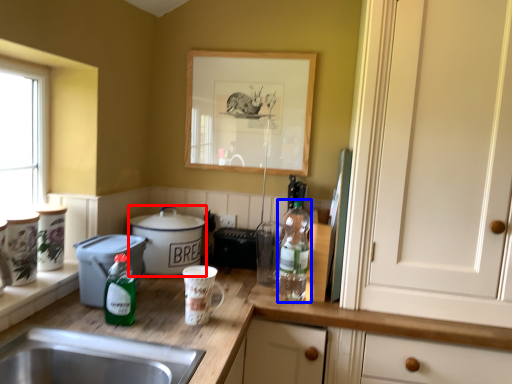
Question: Among these objects, which one is farthest to the camera, cooker (highlighted by a red box) or bottle (highlighted by a blue box)?

Choices:
 (A) cooker
 (B) bottle

Answer: (A)